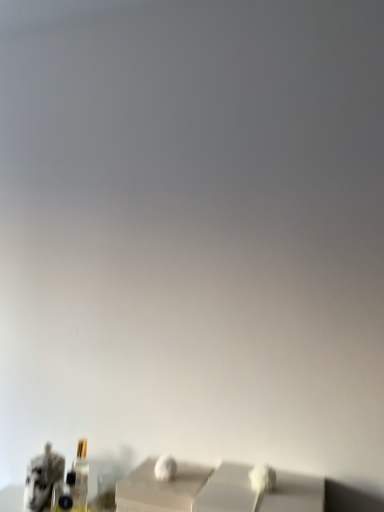
Question: Would you say camouflage-patterned figurine at lower left is outside matte gold bottle at lower left?

Choices:
 (A) yes
 (B) no

Answer: (A)

Question: Considering the relative sizes of camouflage-patterned figurine at lower left and matte gold bottle at lower left in the image provided, is camouflage-patterned figurine at lower left thinner than matte gold bottle at lower left?

Choices:
 (A) yes
 (B) no

Answer: (B)

Question: Can you confirm if camouflage-patterned figurine at lower left is positioned to the left of matte gold bottle at lower left?

Choices:
 (A) no
 (B) yes

Answer: (B)

Question: Is matte gold bottle at lower left at the back of camouflage-patterned figurine at lower left?

Choices:
 (A) yes
 (B) no

Answer: (B)

Question: Is camouflage-patterned figurine at lower left further to camera compared to matte gold bottle at lower left?

Choices:
 (A) yes
 (B) no

Answer: (B)

Question: Is camouflage-patterned figurine at lower left oriented towards matte gold bottle at lower left?

Choices:
 (A) yes
 (B) no

Answer: (B)

Question: Does matte gold bottle at lower left turn towards camouflage-patterned figurine at lower left?

Choices:
 (A) yes
 (B) no

Answer: (B)

Question: Is matte gold bottle at lower left smaller than camouflage-patterned figurine at lower left?

Choices:
 (A) no
 (B) yes

Answer: (B)

Question: Does matte gold bottle at lower left have a greater height compared to camouflage-patterned figurine at lower left?

Choices:
 (A) no
 (B) yes

Answer: (B)

Question: Does matte gold bottle at lower left come in front of camouflage-patterned figurine at lower left?

Choices:
 (A) no
 (B) yes

Answer: (A)

Question: Is matte gold bottle at lower left touching camouflage-patterned figurine at lower left?

Choices:
 (A) yes
 (B) no

Answer: (A)

Question: Does matte gold bottle at lower left lie behind camouflage-patterned figurine at lower left?

Choices:
 (A) yes
 (B) no

Answer: (A)

Question: Looking at their shapes, would you say matte gold bottle at lower left is wider or thinner than camouflage-patterned figurine at lower left?

Choices:
 (A) thin
 (B) wide

Answer: (A)